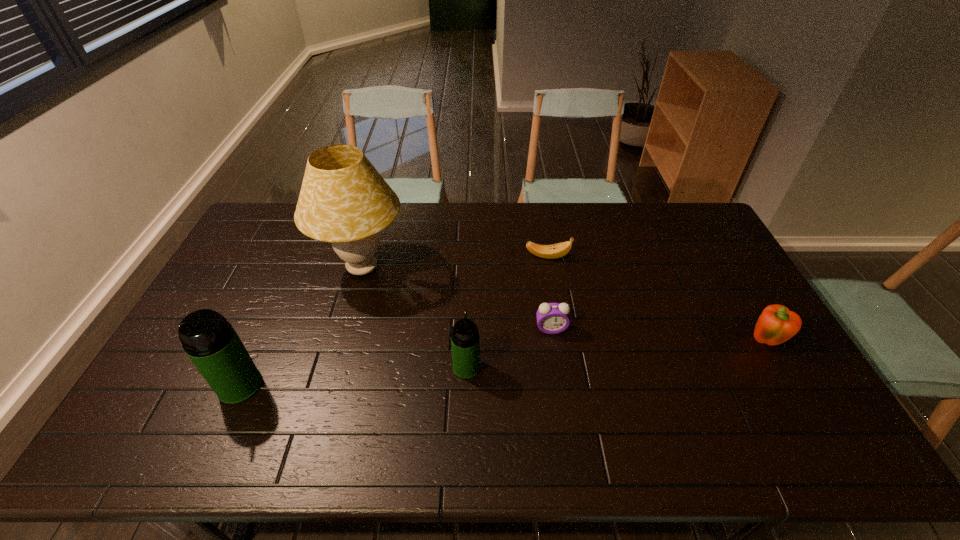
You are a GUI agent. You are given a task and a screenshot of the screen. Output one action in this format:
    pyautogui.click(x=<x>, y=<y>)
    Task: Click on the second tallest object
    
    Given the screenshot: What is the action you would take?
    pyautogui.click(x=210, y=341)

This screenshot has width=960, height=540. I want to click on the left thermos bottle, so click(x=210, y=341).

Identify the location of the right thermos bottle. This screenshot has width=960, height=540. (465, 341).

Locate an element on the screen. This screenshot has width=960, height=540. the third tallest object is located at coordinates (465, 341).

Image resolution: width=960 pixels, height=540 pixels. What are the coordinates of `lampshade` in the screenshot? It's located at (344, 200).

Find the location of a particular element. This screenshot has width=960, height=540. the tallest object is located at coordinates [344, 200].

Identify the location of banana. (554, 251).

This screenshot has height=540, width=960. Find the location of `alarm clock`. alarm clock is located at coordinates (552, 318).

You are a GUI agent. You are given a task and a screenshot of the screen. Output one action in this format:
    pyautogui.click(x=<x>, y=<y>)
    Task: Click on the third shortest object
    This screenshot has height=540, width=960.
    Given the screenshot: What is the action you would take?
    pyautogui.click(x=777, y=324)

The height and width of the screenshot is (540, 960). Find the location of `the rightmost object`. the rightmost object is located at coordinates (777, 324).